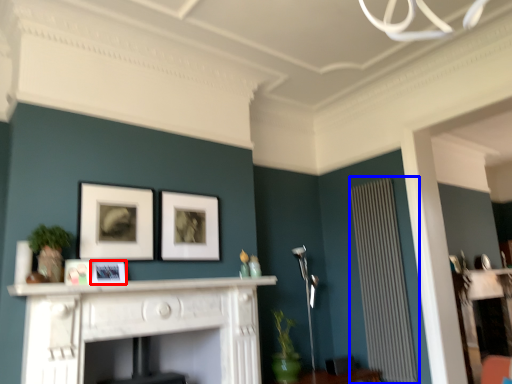
Question: Among these objects, which one is nearest to the camera, picture frame (highlighted by a red box) or radiator (highlighted by a blue box)?

Choices:
 (A) picture frame
 (B) radiator

Answer: (A)